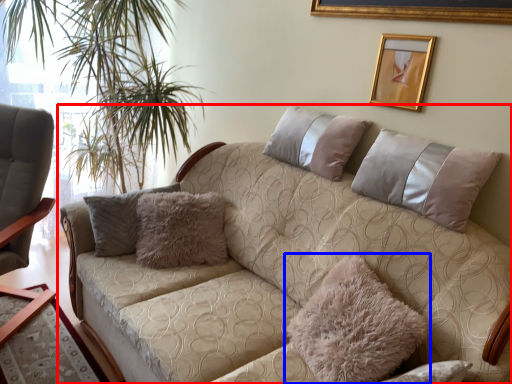
Question: Which object is further to the camera taking this photo, studio couch (highlighted by a red box) or pillow (highlighted by a blue box)?

Choices:
 (A) studio couch
 (B) pillow

Answer: (B)